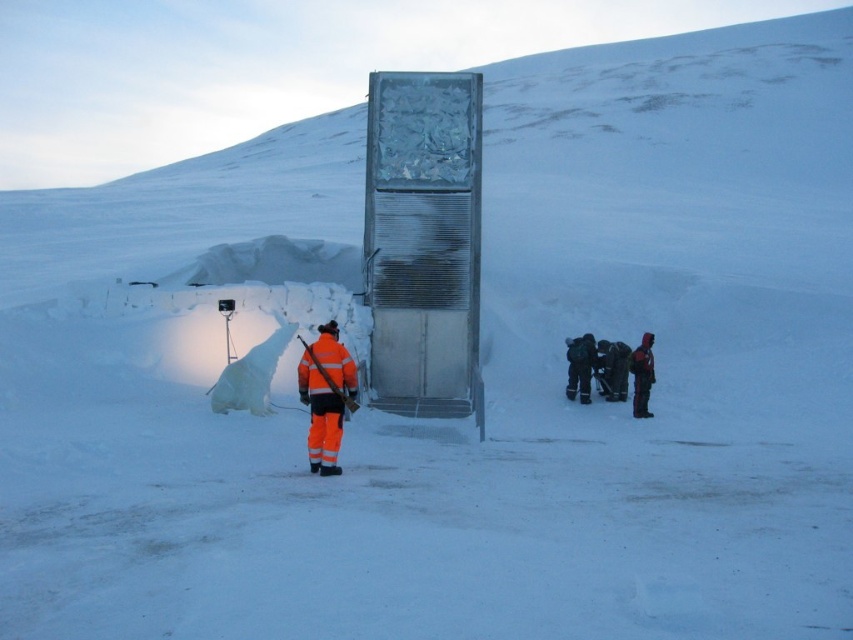
Question: Which point appears closest to the camera in this image?

Choices:
 (A) (576, 346)
 (B) (350, 378)
 (C) (582, 371)
 (D) (350, 394)

Answer: (B)

Question: Is orange reflective jacket at center further to the viewer compared to dark gray fabric jacket at lower center?

Choices:
 (A) yes
 (B) no

Answer: (B)

Question: Which object is positioned farthest from the orange reflective jacket at lower right?

Choices:
 (A) orange reflective jacket at center
 (B) dark gray fabric jacket at lower center

Answer: (A)

Question: Which is farther from the dark gray fabric jacket at lower center?

Choices:
 (A) orange reflective safety vest at center
 (B) orange reflective jacket at lower right

Answer: (A)

Question: Is dark gray fabric jacket at lower center smaller than orange reflective safety vest at center?

Choices:
 (A) no
 (B) yes

Answer: (A)

Question: In this image, where is orange reflective safety vest at center located relative to dark red fabric jacket at lower right?

Choices:
 (A) above
 (B) below

Answer: (A)